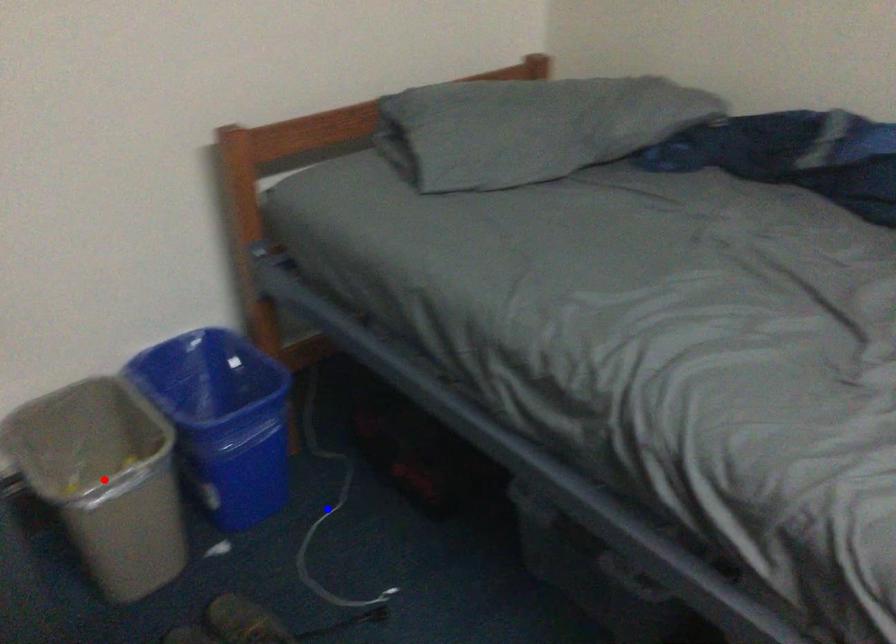
Question: Which of the two points in the image is closer to the camera?

Choices:
 (A) Blue point is closer.
 (B) Red point is closer.

Answer: (B)